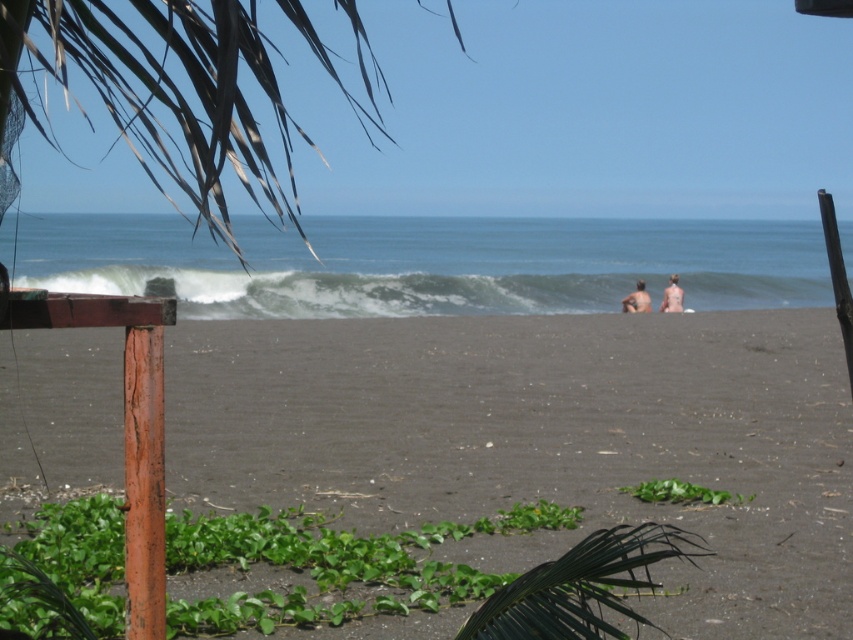
Who is positioned more to the left, naked human at lower right or blonde hair human at right?

blonde hair human at right

Consider the image. Between naked human at lower right and blonde hair human at right, which one has more height?

naked human at lower right is taller.

Does point (666, 285) come in front of point (650, 304)?

No, (666, 285) is behind (650, 304).

I want to click on naked human at lower right, so click(x=672, y=296).

Is brown wood pole at lower left thinner than blonde hair human at right?

Yes.

Locate an element on the screen. brown wood pole at lower left is located at coordinates (144, 481).

In order to click on brown wood pole at lower left in this screenshot , I will do `click(144, 481)`.

Does brown wood pole at lower left appear under naked human at lower right?

Yes.

Is brown wood pole at lower left wider than naked human at lower right?

In fact, brown wood pole at lower left might be narrower than naked human at lower right.

Which is in front, point (154, 609) or point (674, 280)?

Point (154, 609) is in front.

Where is `brown wood pole at lower left`? The image size is (853, 640). brown wood pole at lower left is located at coordinates (144, 481).